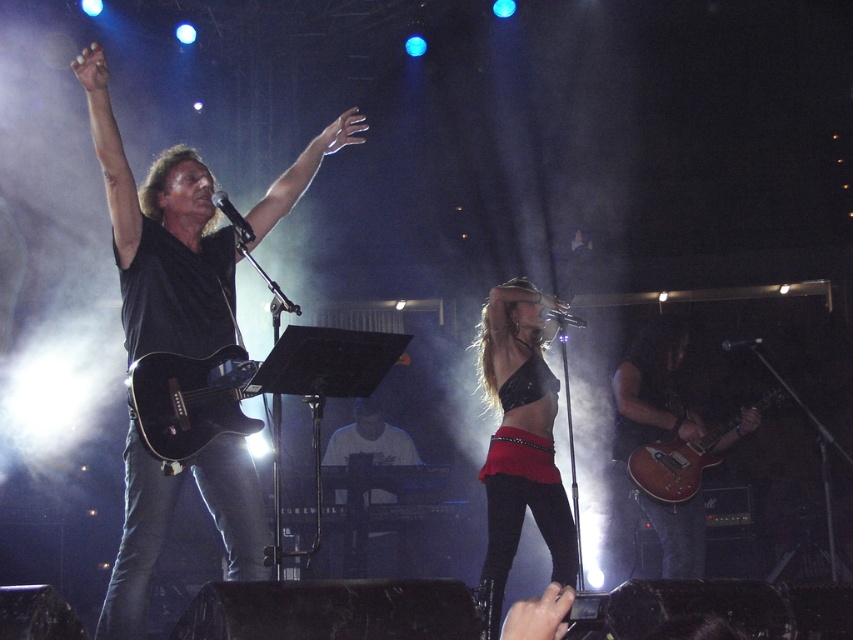
You are a stagehand who needs to place a 1.2 meter tall amplifier next to the black matte guitar at upper left and the glossy wood electric guitar at lower right. Can you fit the amplifier between them without moving the guitars?

The black matte guitar at upper left is much taller than the glossy wood electric guitar at lower right. Since the amplifier is 1.2 meters tall, it can be placed between them as the height difference allows sufficient space.

You are a stagehand who needs to adjust the microphone stand between the black matte guitar at upper left and the glossy black guitar at center. Which guitar should you move the microphone stand closer to if you want it positioned to the right side of the stage?

The black matte guitar at upper left is to the right of the glossy black guitar at center, so moving the microphone stand closer to the black matte guitar at upper left would position it to the right side of the stage.